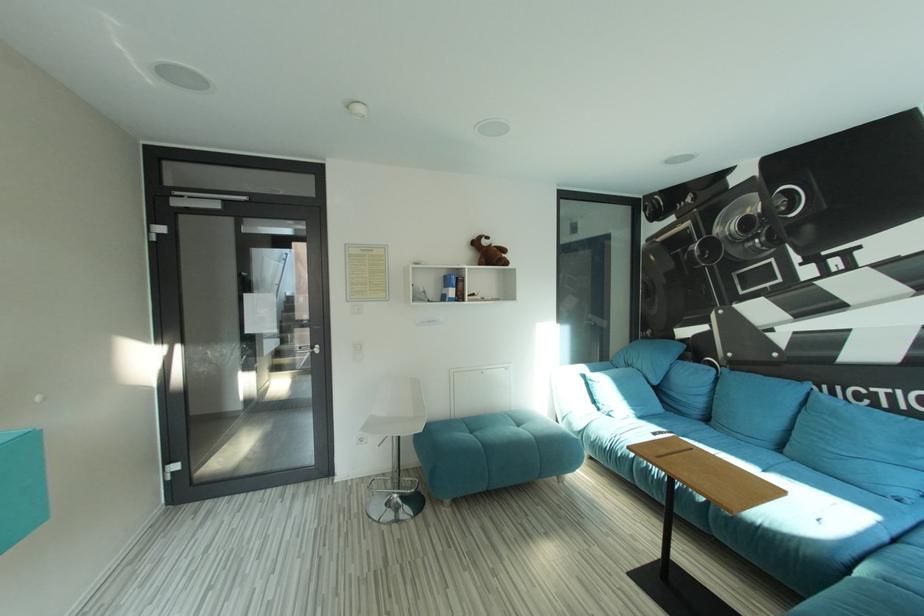
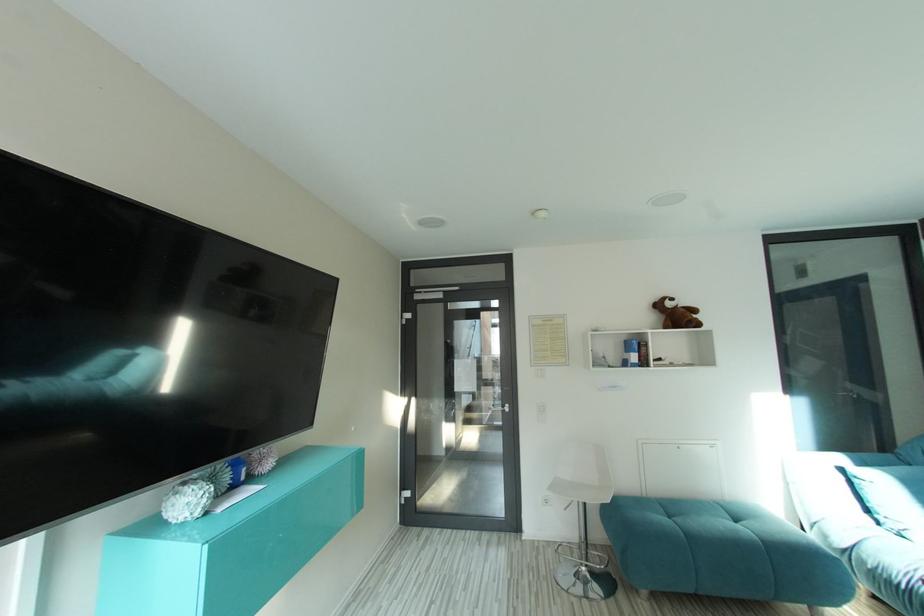
Question: The camera is either moving clockwise (left) or counter-clockwise (right) around the object. The first image is from the beginning of the video and the second image is from the end. Is the camera moving left or right when shooting the video?

Choices:
 (A) Left
 (B) Right

Answer: (B)